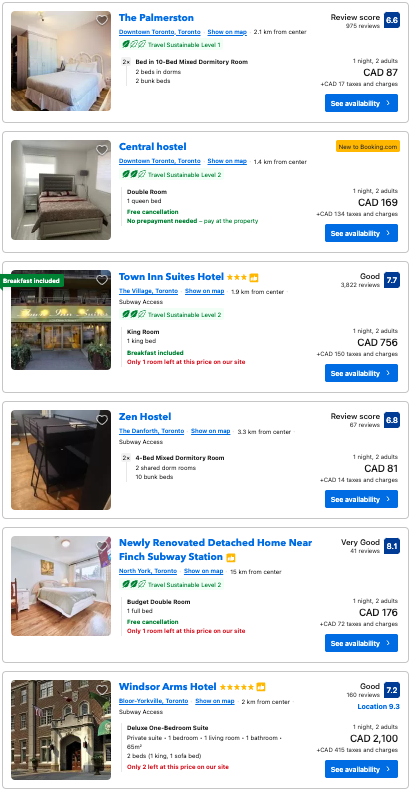
Find the location of `lamp`. lamp is located at coordinates (85, 170), (64, 581), (62, 58).